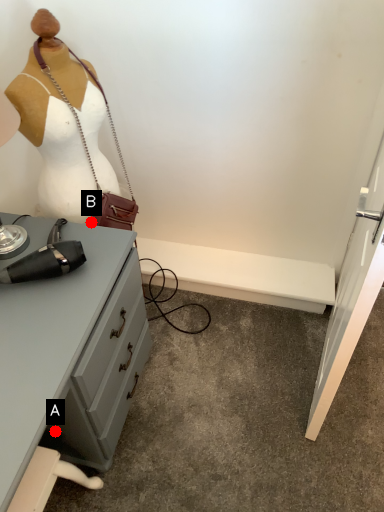
Question: Two points are circled on the image, labeled by A and B beside each circle. Which of the following is the farthest from the observer?

Choices:
 (A) A is further
 (B) B is further

Answer: (B)